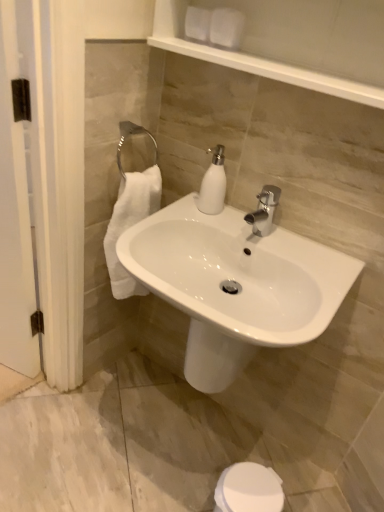
Question: Does white glossy sink at center have a greater width compared to white glossy soap dispenser at center?

Choices:
 (A) yes
 (B) no

Answer: (A)

Question: Is white glossy sink at center further to camera compared to white glossy soap dispenser at center?

Choices:
 (A) yes
 (B) no

Answer: (B)

Question: Is white glossy sink at center next to white glossy soap dispenser at center?

Choices:
 (A) no
 (B) yes

Answer: (A)

Question: Considering the relative sizes of white glossy sink at center and white glossy soap dispenser at center in the image provided, is white glossy sink at center shorter than white glossy soap dispenser at center?

Choices:
 (A) no
 (B) yes

Answer: (A)

Question: Is white glossy sink at center not close to white glossy soap dispenser at center?

Choices:
 (A) yes
 (B) no

Answer: (B)

Question: Is white glossy sink at center at the right side of white glossy soap dispenser at center?

Choices:
 (A) no
 (B) yes

Answer: (A)

Question: Are white matte toilet paper at upper center and white wood screen door at left making contact?

Choices:
 (A) no
 (B) yes

Answer: (A)

Question: Is white matte toilet paper at upper center positioned before white wood screen door at left?

Choices:
 (A) yes
 (B) no

Answer: (B)

Question: Is white matte toilet paper at upper center to the left of white wood screen door at left from the viewer's perspective?

Choices:
 (A) yes
 (B) no

Answer: (B)

Question: Is white matte toilet paper at upper center positioned behind white wood screen door at left?

Choices:
 (A) yes
 (B) no

Answer: (A)

Question: Is white matte toilet paper at upper center far from white wood screen door at left?

Choices:
 (A) yes
 (B) no

Answer: (B)

Question: From the image's perspective, would you say white matte toilet paper at upper center is shown under white wood screen door at left?

Choices:
 (A) no
 (B) yes

Answer: (A)

Question: Can you confirm if white glossy soap dispenser at center is positioned to the right of white glossy sink at center?

Choices:
 (A) no
 (B) yes

Answer: (B)